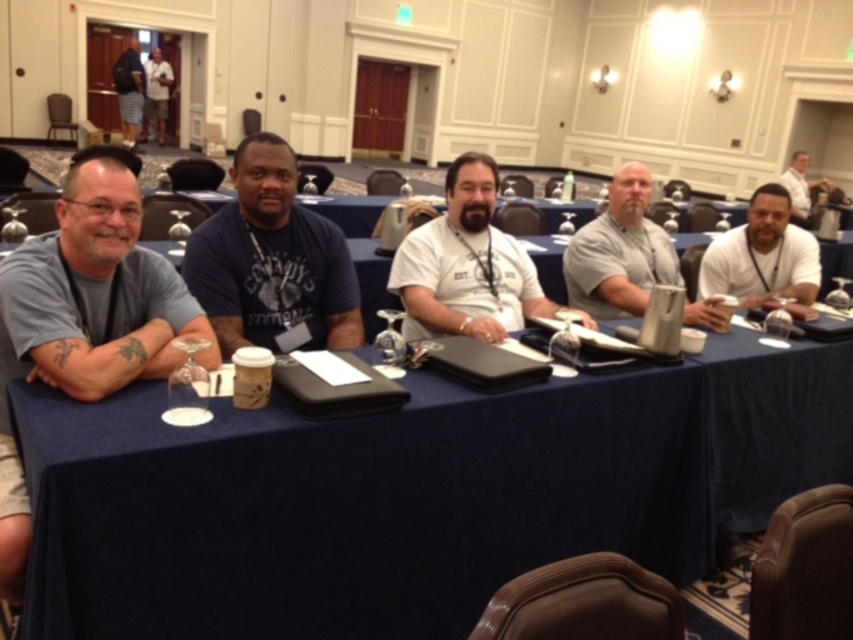
You are sitting at the long table in the conference room and want to hand a document to the person wearing the white cotton shirt at center and the white matte shirt at center. Which shirt should you target first to ensure the document reaches the closer person?

You should hand the document to the white cotton shirt at center first because it is closer to you than the white matte shirt at center.

You are organizing a team meeting and need to identify the seating arrangement based on the shirts. There are two people wearing white cotton shirt at center and white matte shirt at center. Which one is sitting to the left of the other?

A: The white cotton shirt at center is to the left of white matte shirt at center.

You are a person sitting at the conference table in the image. You want to reach for the gray matte mug at center without getting up. Can you do it comfortably?

The gray matte mug at center is 9.22 feet away from you, which is too far to reach comfortably without getting up. You would need to stand or move closer to get it.